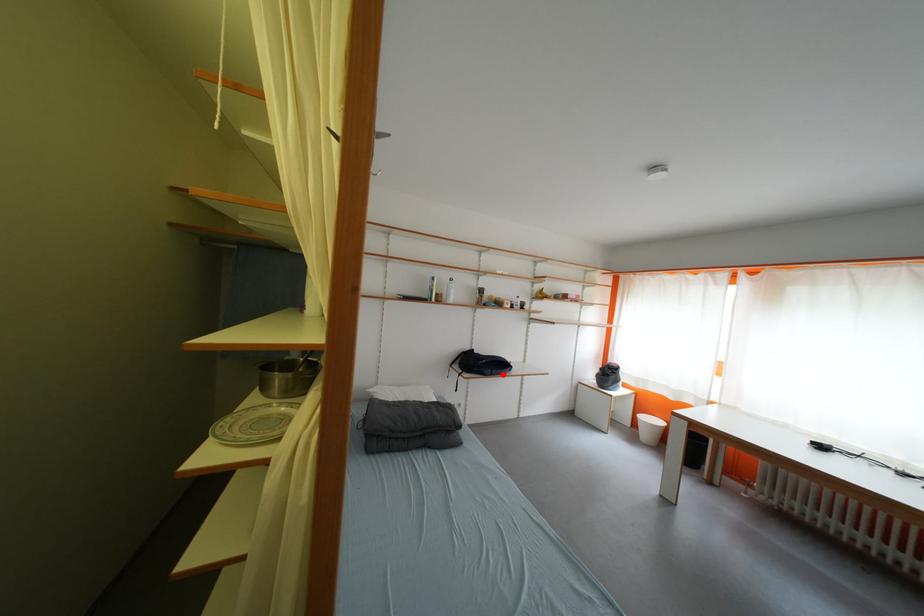
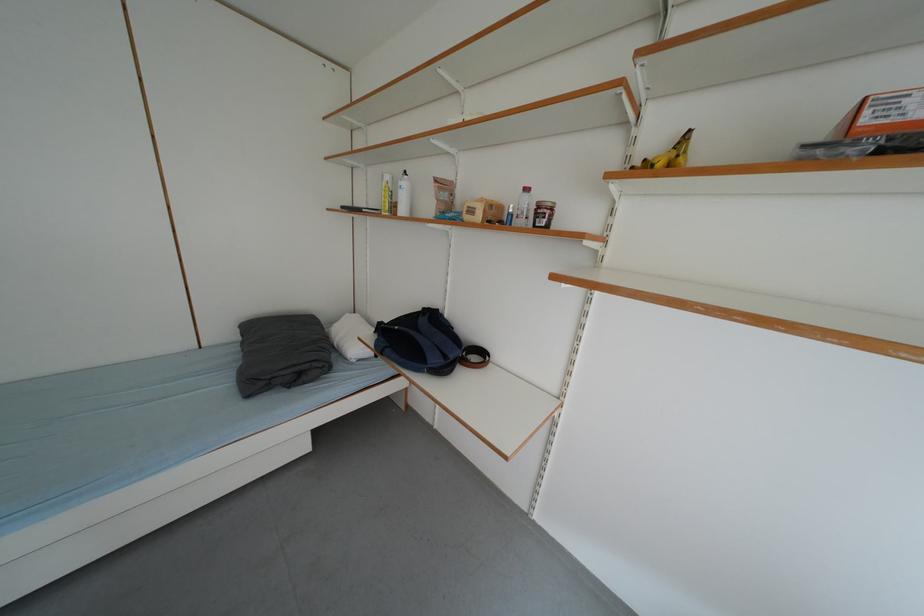
In the second image, find the point that corresponds to the highlighted location in the first image.

(396, 354)